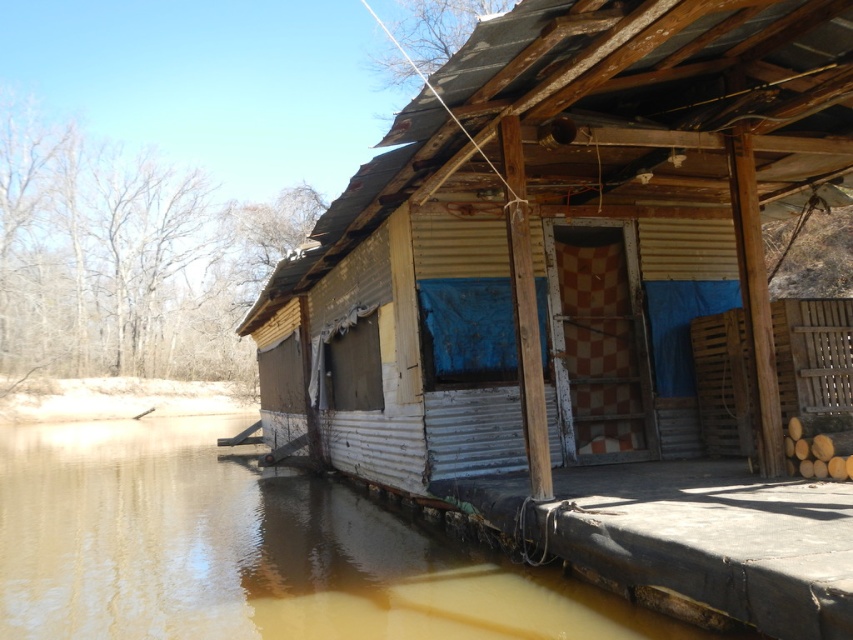
You are standing at the point labeled point at (x=798, y=308). You want to reach the door of the structure. The door is located at the center of the front wall. Can you walk straight towards the door without any obstacles?

Yes, you can walk straight towards the door because the distance between you and the door is 22.36 feet, and there are no obstacles mentioned in the scene description that would block your path.

You are a hiker who has just arrived at the scene and wants to cross the brown murky water at lower left to reach the yellow corrugated metal hut at center. Is the hut accessible by walking directly towards it from your current position?

The yellow corrugated metal hut at center is in front of brown murky water at lower left, so yes, the hiker can walk directly towards the hut as it is positioned in front of the water, meaning the water is behind the hut relative to the hiker.

You are a delivery drone carrying a package that requires a landing zone at least 3 meters away from any water source. You need to land near the yellow corrugated metal hut at center and the brown murky water at lower left. Can you safely land your drone here?

The distance between the yellow corrugated metal hut at center and the brown murky water at lower left is 2.82 meters, which is less than the required 3 meters. Therefore, the drone cannot safely land here as it does not meet the minimum distance requirement.